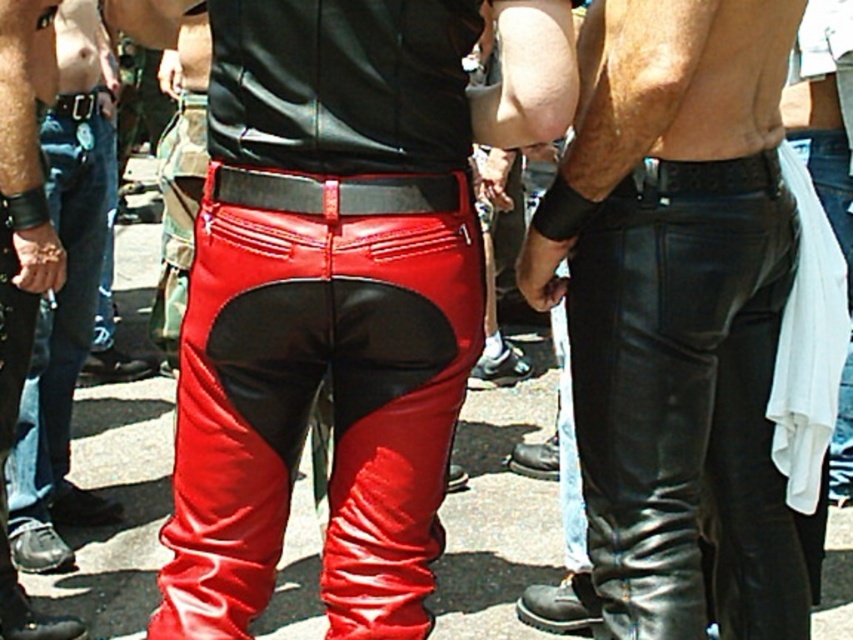
You are a fashion designer observing the image. You need to determine the correct order of the shiny leather pants at center and the black leather belt at center from top to bottom. Which one is positioned lower?

The shiny leather pants at center is positioned lower than the black leather belt at center.

You are a tailor trying to determine which item takes up more space in the storage closet. Based on the image, which is larger in size between the shiny red leather pants at center and the black leather belt at center?

The shiny red leather pants at center is bigger than the black leather belt at center, so the shiny red leather pants at center takes up more space in the storage closet.

You are a photographer setting up a shoot. You need to position a spotlight to the right of the shiny red leather pants at center and to the left of the black leather belt at center. Is there enough space between them to place the spotlight?

The shiny red leather pants at center is to the left of the black leather belt at center, so there is space between them to place the spotlight.